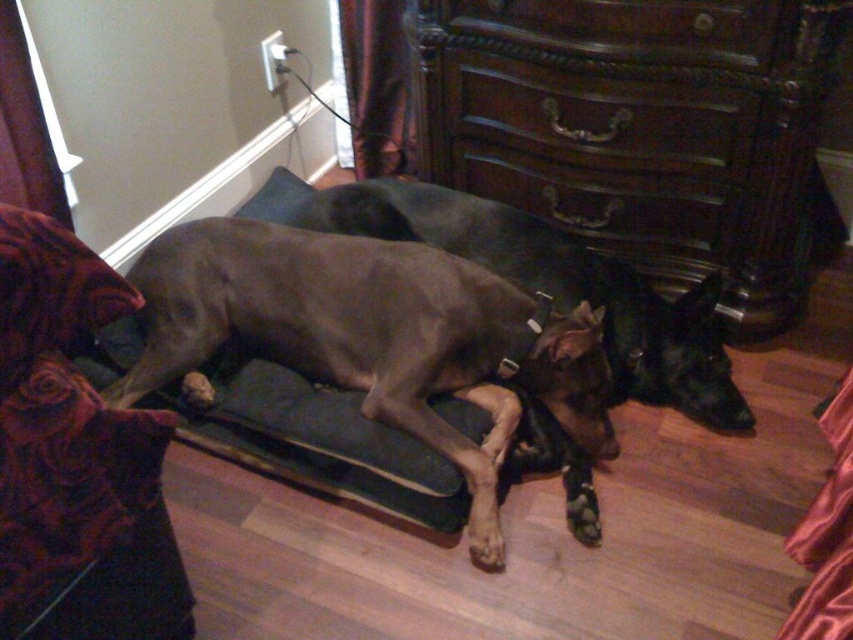
Is the position of dark wood dresser at center less distant than that of smooth gray dog at center?

Yes, dark wood dresser at center is in front of smooth gray dog at center.

Which of these two, dark wood dresser at center or smooth gray dog at center, stands shorter?

smooth gray dog at center is shorter.

Which is behind, point (772, 257) or point (300, 243)?

Point (772, 257)

Locate an element on the screen. The image size is (853, 640). dark wood dresser at center is located at coordinates (640, 129).